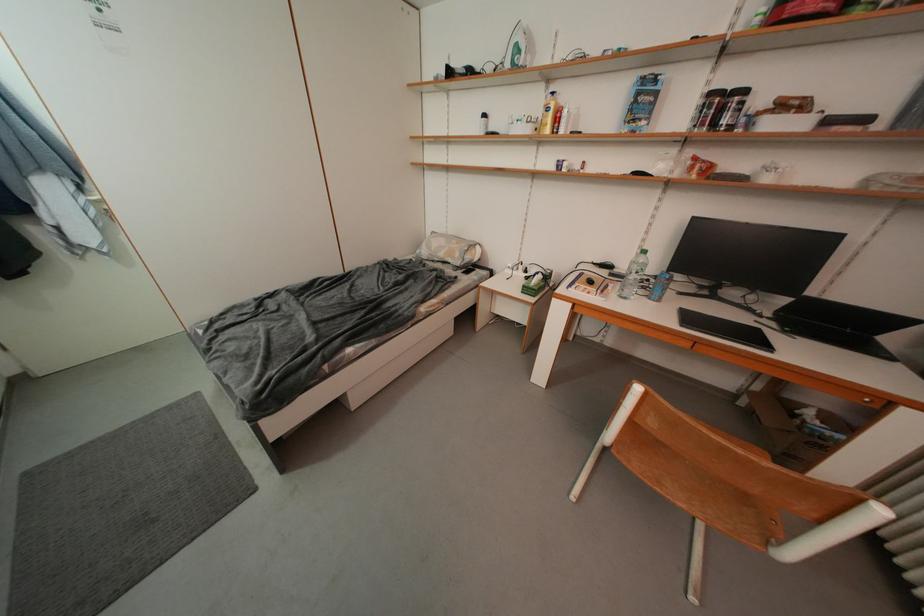
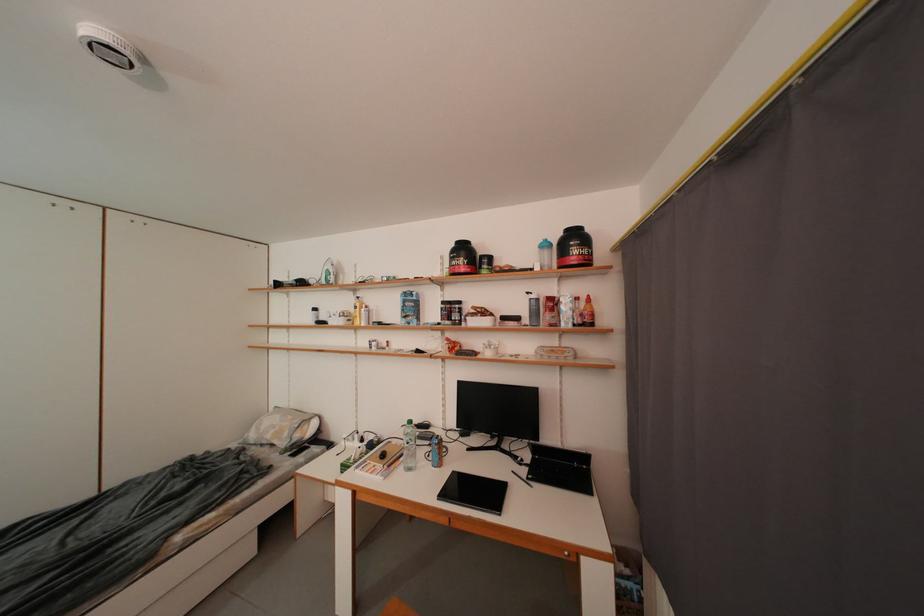
Find the pixel in the second image that matches pixel 598 285 in the first image.

(391, 459)